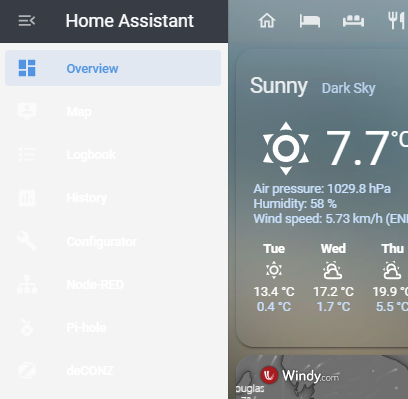
You are a GUI agent. You are given a task and a screenshot of the screen. Output one action in this format:
    pyautogui.click(x=<x>, y=<y>)
    Task: Click on the edges of window boxes
    
    Given the screenshot: What is the action you would take?
    pyautogui.click(x=241, y=362), pyautogui.click(x=240, y=340), pyautogui.click(x=229, y=22)